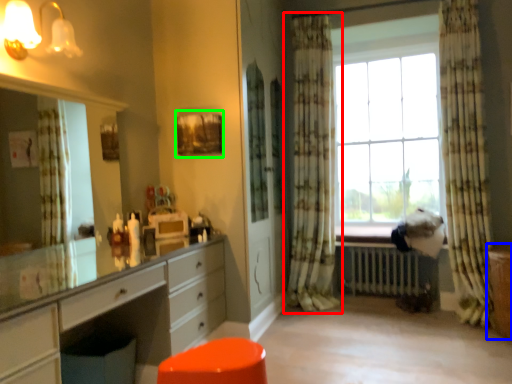
Question: Considering the real-world distances, which object is farthest from curtain (highlighted by a red box)? file cabinet (highlighted by a blue box) or picture frame (highlighted by a green box)?

Choices:
 (A) file cabinet
 (B) picture frame

Answer: (A)